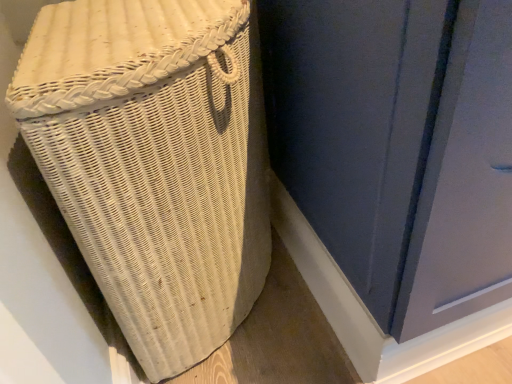
Identify the location of matte blue screen door at center. (356, 124).

The image size is (512, 384). What do you see at coordinates (356, 124) in the screenshot?
I see `matte blue screen door at center` at bounding box center [356, 124].

What do you see at coordinates (154, 163) in the screenshot? The image size is (512, 384). I see `white wicker basket at left` at bounding box center [154, 163].

You are a GUI agent. You are given a task and a screenshot of the screen. Output one action in this format:
    pyautogui.click(x=<x>, y=<y>)
    Task: Click on the white wicker basket at left
    The image size is (512, 384).
    Given the screenshot: What is the action you would take?
    pyautogui.click(x=154, y=163)

Locate an element on the screen. The image size is (512, 384). matte blue screen door at center is located at coordinates (356, 124).

Is white wicker basket at left at the right side of matte blue screen door at center?

No.

In the scene shown: Considering the positions of objects white wicker basket at left and matte blue screen door at center in the image provided, who is in front, white wicker basket at left or matte blue screen door at center?

Positioned in front is matte blue screen door at center.

Considering the positions of point (45, 173) and point (446, 55), is point (45, 173) closer or farther from the camera than point (446, 55)?

Point (45, 173).

From the image's perspective, is white wicker basket at left on matte blue screen door at center?

No, from the image's perspective, white wicker basket at left is not on top of matte blue screen door at center.

From a real-world perspective, between white wicker basket at left and matte blue screen door at center, who is vertically higher?

From a 3D spatial view, matte blue screen door at center is above.

Considering the sizes of objects white wicker basket at left and matte blue screen door at center in the image provided, who is thinner, white wicker basket at left or matte blue screen door at center?

white wicker basket at left is thinner.

Between white wicker basket at left and matte blue screen door at center, which one has more height?

white wicker basket at left is taller.

Is white wicker basket at left bigger or smaller than matte blue screen door at center?

Considering their sizes, white wicker basket at left takes up less space than matte blue screen door at center.

Is white wicker basket at left positioned beyond the bounds of matte blue screen door at center?

Absolutely, white wicker basket at left is external to matte blue screen door at center.

Is white wicker basket at left next to matte blue screen door at center?

No, white wicker basket at left is not next to matte blue screen door at center.

Is white wicker basket at left facing towards matte blue screen door at center?

No, white wicker basket at left does not turn towards matte blue screen door at center.

How different are the orientations of white wicker basket at left and matte blue screen door at center in degrees?

The angle between the facing direction of white wicker basket at left and the facing direction of matte blue screen door at center is 1.67 degrees.

I want to click on furniture behind the matte blue screen door at center, so click(154, 163).

Does matte blue screen door at center appear on the right side of white wicker basket at left?

Indeed, matte blue screen door at center is positioned on the right side of white wicker basket at left.

Which object is further away from the camera, matte blue screen door at center or white wicker basket at left?

Positioned behind is white wicker basket at left.

Which point is more distant from viewer, (381, 187) or (179, 334)?

The point (179, 334) is farther from the camera.

From the image's perspective, which is below, matte blue screen door at center or white wicker basket at left?

white wicker basket at left is shown below in the image.

From a real-world perspective, is matte blue screen door at center above or below white wicker basket at left?

In terms of real-world spatial position, matte blue screen door at center is above white wicker basket at left.

Which of these two, matte blue screen door at center or white wicker basket at left, is wider?

Wider between the two is matte blue screen door at center.

Considering the sizes of objects matte blue screen door at center and white wicker basket at left in the image provided, who is taller, matte blue screen door at center or white wicker basket at left?

With more height is white wicker basket at left.

Based on their sizes in the image, would you say matte blue screen door at center is bigger or smaller than white wicker basket at left?

matte blue screen door at center is bigger than white wicker basket at left.

Choose the correct answer: Is matte blue screen door at center inside white wicker basket at left or outside it?

matte blue screen door at center is not inside white wicker basket at left, it's outside.

Is matte blue screen door at center touching white wicker basket at left?

matte blue screen door at center and white wicker basket at left are not in contact.

Is matte blue screen door at center looking in the opposite direction of white wicker basket at left?

matte blue screen door at center does not have its back to white wicker basket at left.

Can you tell me how much matte blue screen door at center and white wicker basket at left differ in facing direction?

They differ by 1.67 degrees in their facing directions.

At what (x,y) coordinates should I click in order to perform the action: click on furniture below the matte blue screen door at center (from the image's perspective). Please return your answer as a coordinate pair (x, y). Looking at the image, I should click on (154, 163).

Locate an element on the screen. This screenshot has height=384, width=512. furniture that is under the matte blue screen door at center (from a real-world perspective) is located at coordinates (154, 163).

Where is `furniture behind the matte blue screen door at center`? The height and width of the screenshot is (384, 512). furniture behind the matte blue screen door at center is located at coordinates (154, 163).